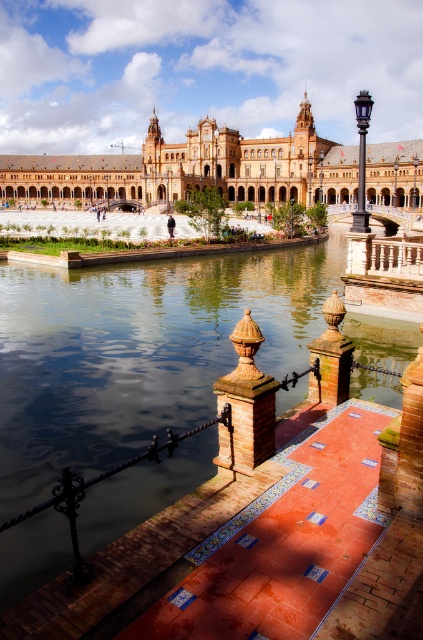
Is point (340, 179) positioned behind point (241, 408)?

Yes, it is behind point (241, 408).

Is matte stone palace at center below terracotta textured pillar at center?

No.

You are a GUI agent. You are given a task and a screenshot of the screen. Output one action in this format:
    pyautogui.click(x=<x>, y=<y>)
    Task: Click on the matte stone palace at center
    
    Given the screenshot: What is the action you would take?
    pyautogui.click(x=194, y=168)

This screenshot has width=423, height=640. I want to click on matte stone palace at center, so click(x=194, y=168).

Who is taller, matte stone palace at center or polished bronze pillar at center?

With more height is matte stone palace at center.

Does matte stone palace at center appear over polished bronze pillar at center?

Correct, matte stone palace at center is located above polished bronze pillar at center.

Which is behind, point (10, 193) or point (315, 380)?

The point (10, 193) is more distant.

Locate an element on the screen. The height and width of the screenshot is (640, 423). matte stone palace at center is located at coordinates (194, 168).

Can you confirm if clear water at center is positioned below terracotta textured pillar at center?

No.

Which is above, clear water at center or terracotta textured pillar at center?

Positioned higher is clear water at center.

The width and height of the screenshot is (423, 640). Identify the location of clear water at center. point(139,352).